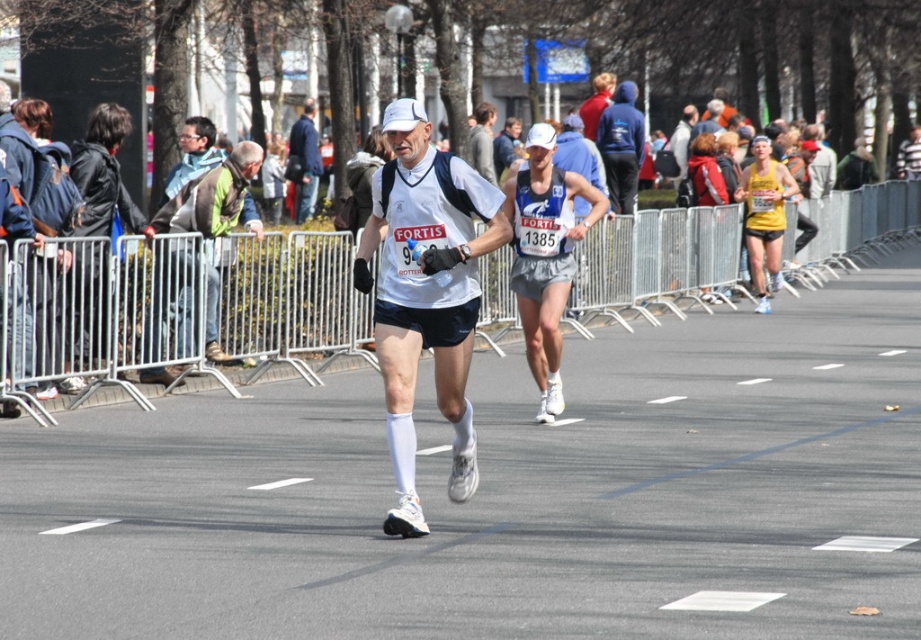
Question: Is the position of green fabric jacket at left more distant than that of yellow fabric tank top at right?

Choices:
 (A) no
 (B) yes

Answer: (A)

Question: Which point is closer to the camera?

Choices:
 (A) (695, 116)
 (B) (762, 211)

Answer: (B)

Question: Which object appears farthest from the camera in this image?

Choices:
 (A) light brown leather jacket at upper center
 (B) white matte shorts at center
 (C) leather jacket at left

Answer: (A)

Question: Which object is the farthest from the matte white tank top at center?

Choices:
 (A) white matte running shorts at center
 (B) gray fabric jacket at upper center

Answer: (A)

Question: Does blue denim jacket at left lie behind yellow fabric tank top at right?

Choices:
 (A) yes
 (B) no

Answer: (B)

Question: Does blue denim jacket at left appear on the left side of matte white tank top at center?

Choices:
 (A) no
 (B) yes

Answer: (B)